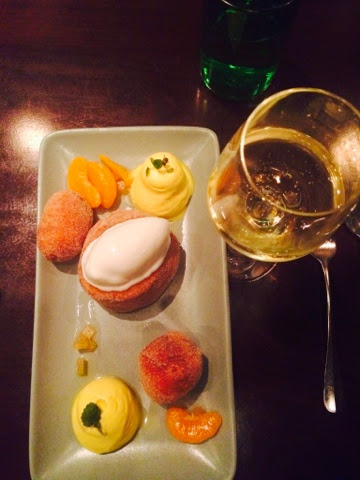
This screenshot has width=360, height=480. What are the coordinates of `cup` in the screenshot? It's located at (313, 240).